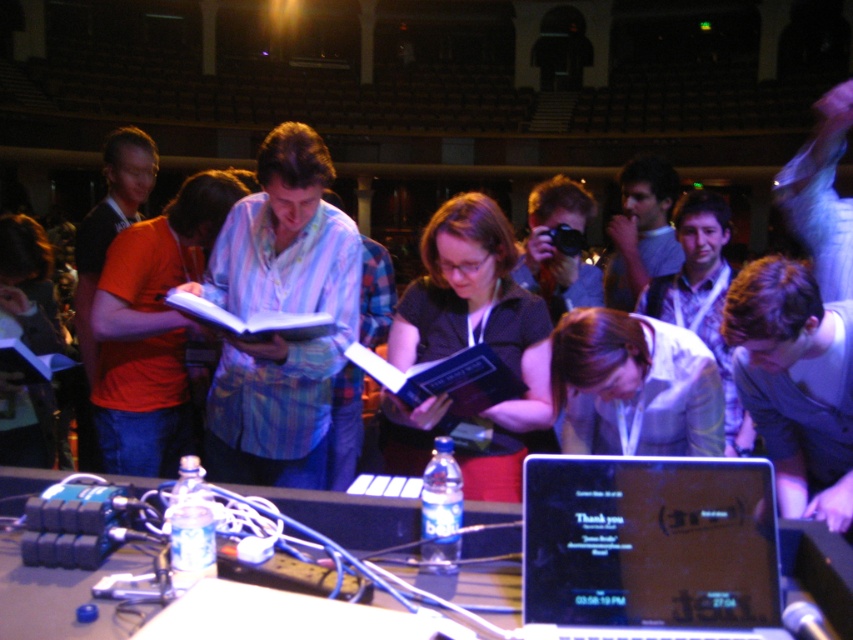
Question: Among these objects, which one is farthest from the camera?

Choices:
 (A) matte black book at center
 (B) white glossy shirt at lower center

Answer: (A)

Question: Is white glossy shirt at lower center below clear plastic water bottle at center?

Choices:
 (A) no
 (B) yes

Answer: (A)

Question: Does black plastic laptop at center lie in front of clear plastic water bottle at center?

Choices:
 (A) yes
 (B) no

Answer: (A)

Question: Is black plastic laptop at center bigger than white glossy shirt at lower center?

Choices:
 (A) yes
 (B) no

Answer: (B)

Question: Which point is farther from the camera taking this photo?

Choices:
 (A) (492, 432)
 (B) (523, 538)
 (C) (33, 468)

Answer: (A)

Question: Which object is closer to the camera taking this photo?

Choices:
 (A) clear plastic water bottle at center
 (B) white glossy shirt at lower center
 (C) black plastic laptop at center
 (D) matte black book at center

Answer: (C)